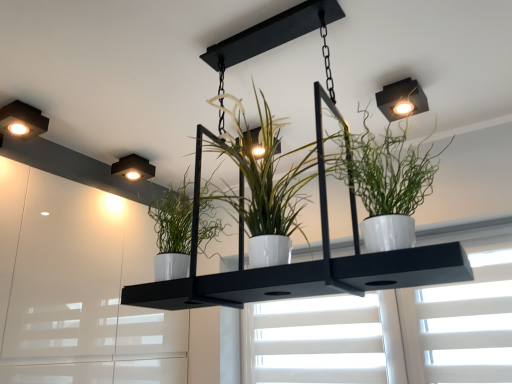
Question: Does white matte window at center have a lesser height compared to matte black square light at upper right?

Choices:
 (A) yes
 (B) no

Answer: (B)

Question: Does white matte window at center have a greater width compared to matte black square light at upper right?

Choices:
 (A) yes
 (B) no

Answer: (B)

Question: From a real-world perspective, is white matte window at center located beneath matte black square light at upper right?

Choices:
 (A) no
 (B) yes

Answer: (B)

Question: Is white matte window at center looking in the opposite direction of matte black square light at upper right?

Choices:
 (A) yes
 (B) no

Answer: (B)

Question: Is matte black square light at upper right a part of white matte window at center?

Choices:
 (A) no
 (B) yes

Answer: (A)

Question: Based on their sizes in the image, would you say white glossy cabinet at left is bigger or smaller than white matte window at center?

Choices:
 (A) small
 (B) big

Answer: (B)

Question: From their relative heights in the image, would you say white glossy cabinet at left is taller or shorter than white matte window at center?

Choices:
 (A) tall
 (B) short

Answer: (A)

Question: Is white glossy cabinet at left spatially inside white matte window at center, or outside of it?

Choices:
 (A) outside
 (B) inside

Answer: (A)

Question: Is point (2, 165) positioned closer to the camera than point (266, 365)?

Choices:
 (A) closer
 (B) farther

Answer: (A)

Question: From a real-world perspective, is white matte window at center above or below matte black square light fixture at upper left, acting as the 2th lamp starting from the top?

Choices:
 (A) above
 (B) below

Answer: (B)

Question: Do you think white matte window at center is within matte black square light fixture at upper left, which is counted as the second lamp, starting from the left, or outside of it?

Choices:
 (A) inside
 (B) outside

Answer: (B)

Question: Looking at the image, does white matte window at center seem bigger or smaller compared to matte black square light fixture at upper left, which appears as the first lamp when viewed from the back?

Choices:
 (A) big
 (B) small

Answer: (A)

Question: From the image's perspective, is white matte window at center located above or below matte black square light fixture at upper left, which appears as the first lamp when viewed from the right?

Choices:
 (A) below
 (B) above

Answer: (A)

Question: From the image's perspective, is white glossy pot at upper right, the 1th houseplant positioned from the right, located above or below white glossy cabinet at left?

Choices:
 (A) above
 (B) below

Answer: (A)

Question: Choose the correct answer: Is white glossy pot at upper right, which ranks as the second houseplant in left-to-right order, inside white glossy cabinet at left or outside it?

Choices:
 (A) inside
 (B) outside

Answer: (B)